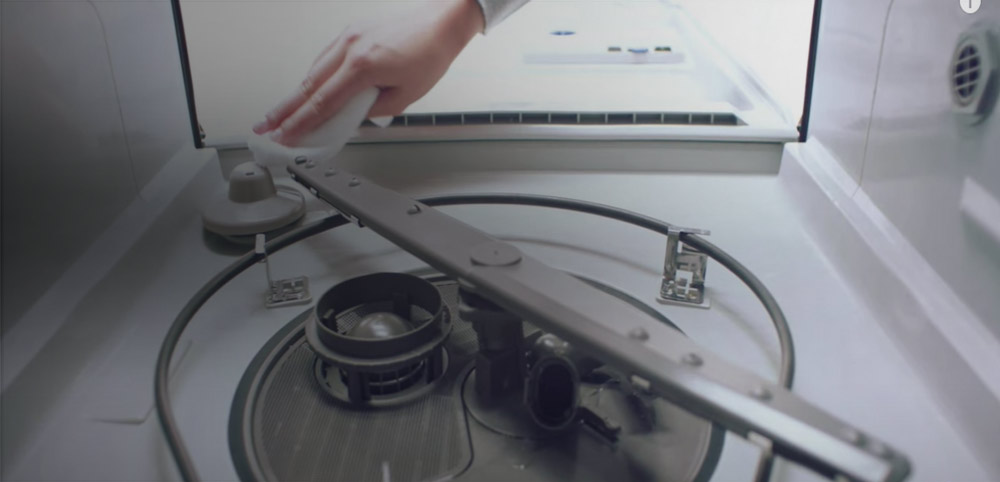
The height and width of the screenshot is (482, 1000). What are the coordinates of `washcloth` in the screenshot? It's located at [x=326, y=126].